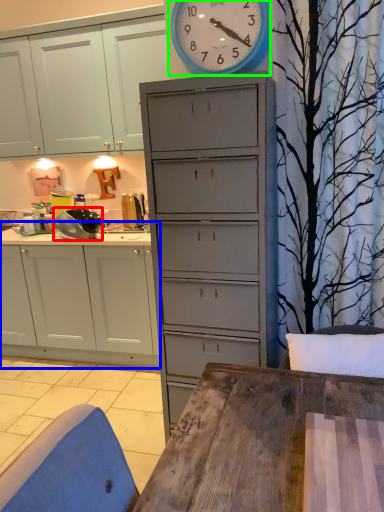
Question: Which object is positioned farthest from appliance (highlighted by a red box)? Select from cabinetry (highlighted by a blue box) and wall clock (highlighted by a green box).

Choices:
 (A) cabinetry
 (B) wall clock

Answer: (B)